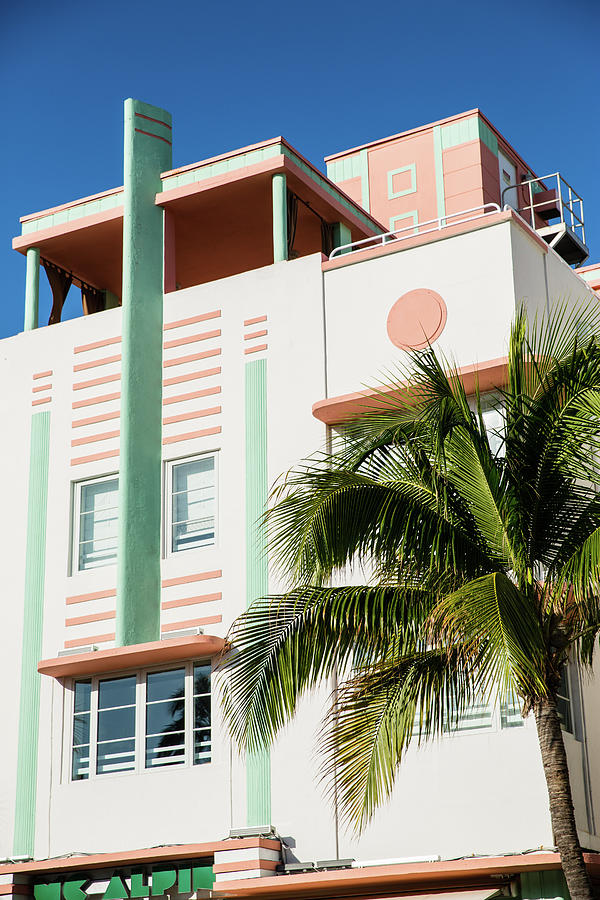
The height and width of the screenshot is (900, 600). I want to click on closed white shade, so click(x=206, y=499), click(x=103, y=527).